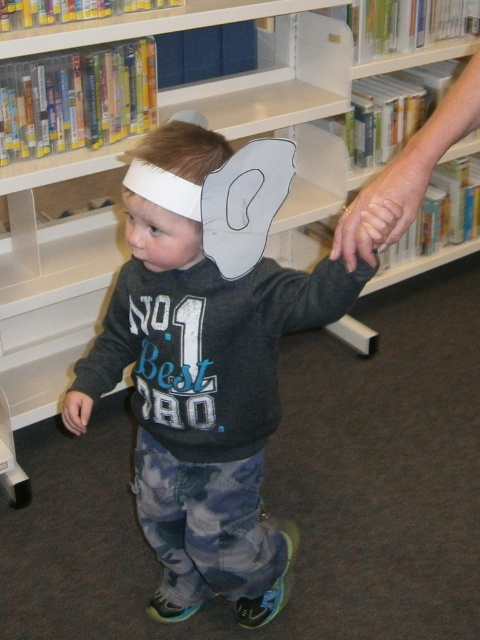
Does point (266, 552) lie behind point (371, 256)?

Yes, it is behind point (371, 256).

Can you confirm if camouflage pants at center is smaller than smooth skin hand at center?

No.

Does point (280, 557) come in front of point (406, 212)?

No.

The height and width of the screenshot is (640, 480). Identify the location of camouflage pants at center. (205, 362).